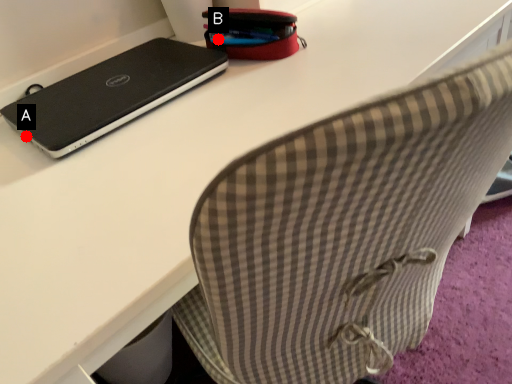
Question: Two points are circled on the image, labeled by A and B beside each circle. Which point is further to the camera?

Choices:
 (A) A is further
 (B) B is further

Answer: (B)